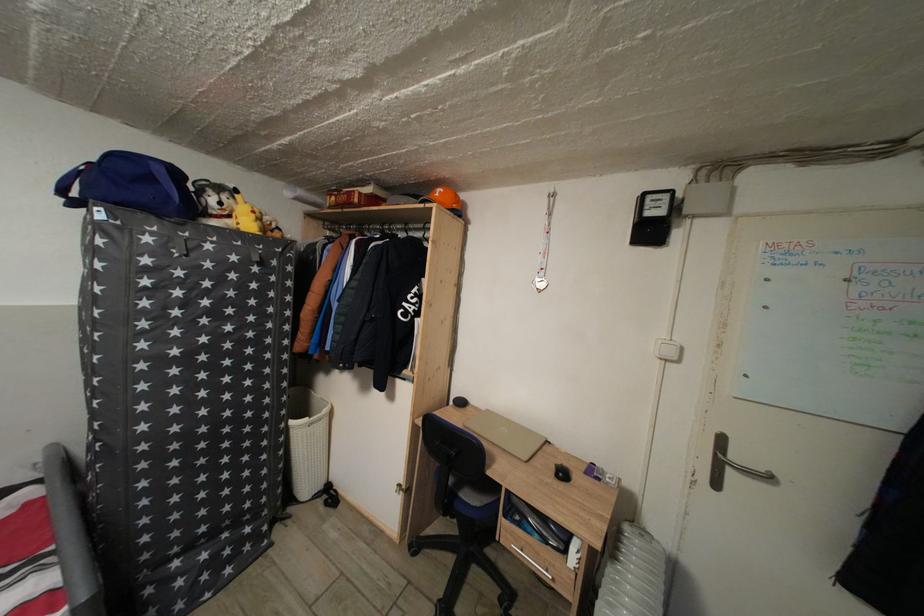
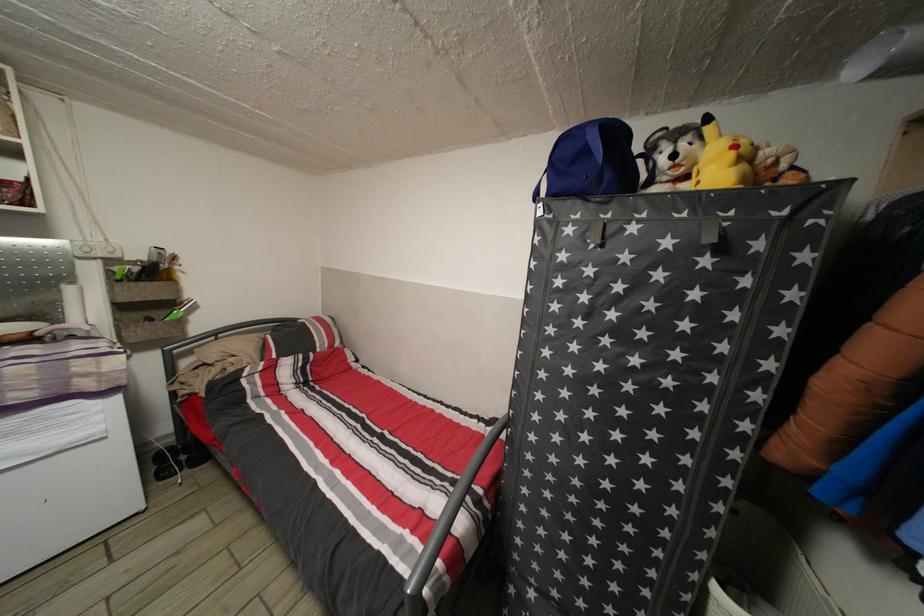
Find the pixel in the second image that matches the point at 298,429 in the first image.

(723, 594)